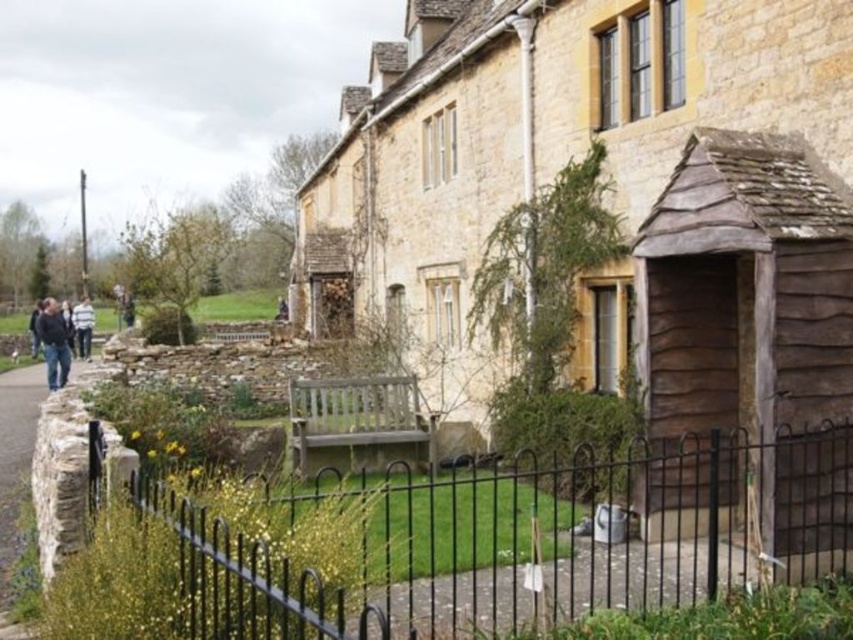
Question: Does black wrought iron fence at lower center appear on the right side of dark blue jeans at left?

Choices:
 (A) no
 (B) yes

Answer: (B)

Question: Among these objects, which one is farthest from the camera?

Choices:
 (A) light brown leather jacket at left
 (B) stone paved path at lower left
 (C) wooden shed at center-right
 (D) wooden shingles shed at lower right

Answer: (A)

Question: Can you confirm if wooden shingles shed at lower right is positioned to the right of dark blue jacket at left?

Choices:
 (A) no
 (B) yes

Answer: (B)

Question: Which point is closer to the camera?

Choices:
 (A) (10, 490)
 (B) (718, 134)
 (C) (792, 321)
 (D) (798, 550)

Answer: (C)

Question: Which object appears closest to the camera in this image?

Choices:
 (A) dark blue jeans at left
 (B) dark blue jacket at left
 (C) stone paved path at lower left

Answer: (C)

Question: Is dark blue jeans at left to the left of light brown leather jacket at left from the viewer's perspective?

Choices:
 (A) no
 (B) yes

Answer: (A)